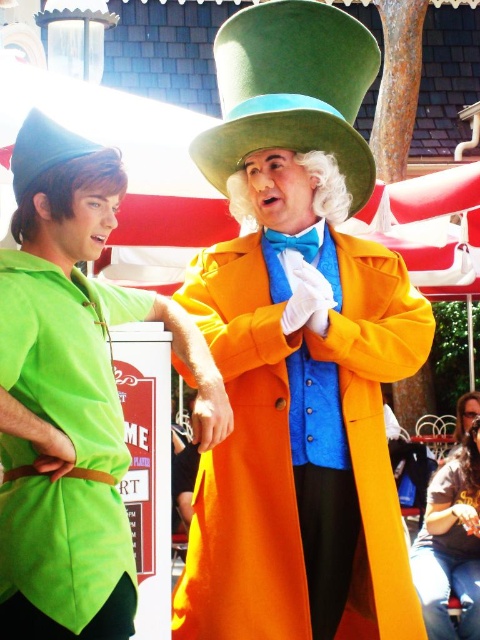
Based on the photo, can you confirm if orange matte coat at center is shorter than matte brown hair at lower right?

In fact, orange matte coat at center may be taller than matte brown hair at lower right.

Who is positioned more to the right, orange matte coat at center or matte brown hair at lower right?

matte brown hair at lower right is more to the right.

Does point (212, 532) come behind point (472, 534)?

No, it is not.

Identify the location of orange matte coat at center. The image size is (480, 640). (289, 448).

Does orange matte coat at center have a greater width compared to blue satin bow tie at center?

Yes, orange matte coat at center is wider than blue satin bow tie at center.

Can you confirm if orange matte coat at center is taller than blue satin bow tie at center?

Correct, orange matte coat at center is much taller as blue satin bow tie at center.

Is point (370, 401) closer to viewer compared to point (298, 252)?

Yes.

Image resolution: width=480 pixels, height=640 pixels. I want to click on orange matte coat at center, so click(289, 448).

The height and width of the screenshot is (640, 480). I want to click on green felt hat at upper center, so click(72, 394).

Measure the distance between green felt hat at upper center and camera.

green felt hat at upper center is 15.57 meters from camera.

Find the location of a particular element. The image size is (480, 640). green felt hat at upper center is located at coordinates pyautogui.click(x=72, y=394).